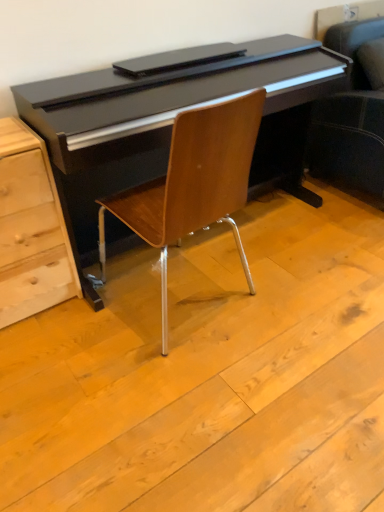
Where is `blank area beneath woodenchair at center (from a real-world perspective)`? blank area beneath woodenchair at center (from a real-world perspective) is located at coordinates (176, 291).